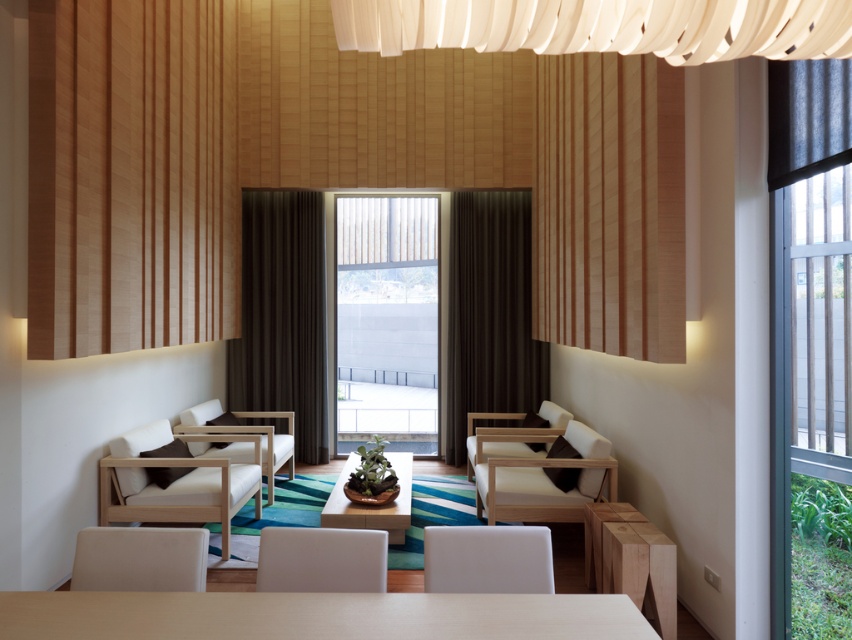
Between point (95, 26) and point (127, 637), which one is positioned in front?

Positioned in front is point (127, 637).

Which is more to the right, wooden paneling at left or light wood table at lower center?

light wood table at lower center is more to the right.

Identify the location of wooden paneling at left. (131, 173).

Does wooden slats at upper center lie behind dark brown fabric curtain at left?

No, it is not.

Does wooden slats at upper center have a lesser width compared to dark brown fabric curtain at left?

Yes, wooden slats at upper center is thinner than dark brown fabric curtain at left.

Measure the distance between wooden slats at upper center and camera.

A distance of 5.04 meters exists between wooden slats at upper center and camera.

I want to click on wooden slats at upper center, so click(x=609, y=204).

Who is taller, metallic glass window at right or light wood table at lower center?

With more height is metallic glass window at right.

Is metallic glass window at right positioned behind light wood table at lower center?

Yes, it is.

Does point (806, 621) come farther from viewer compared to point (465, 616)?

Yes, point (806, 621) is behind point (465, 616).

You are a GUI agent. You are given a task and a screenshot of the screen. Output one action in this format:
    pyautogui.click(x=<x>, y=<y>)
    Task: Click on the metallic glass window at right
    The width and height of the screenshot is (852, 640).
    Given the screenshot: What is the action you would take?
    pyautogui.click(x=810, y=346)